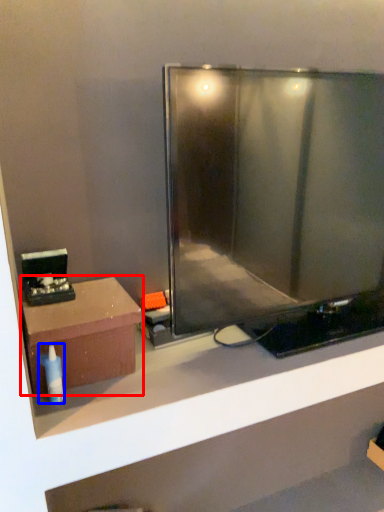
Question: Which of the following is the farthest to the observer, furniture (highlighted by a red box) or toiletry (highlighted by a blue box)?

Choices:
 (A) furniture
 (B) toiletry

Answer: (A)